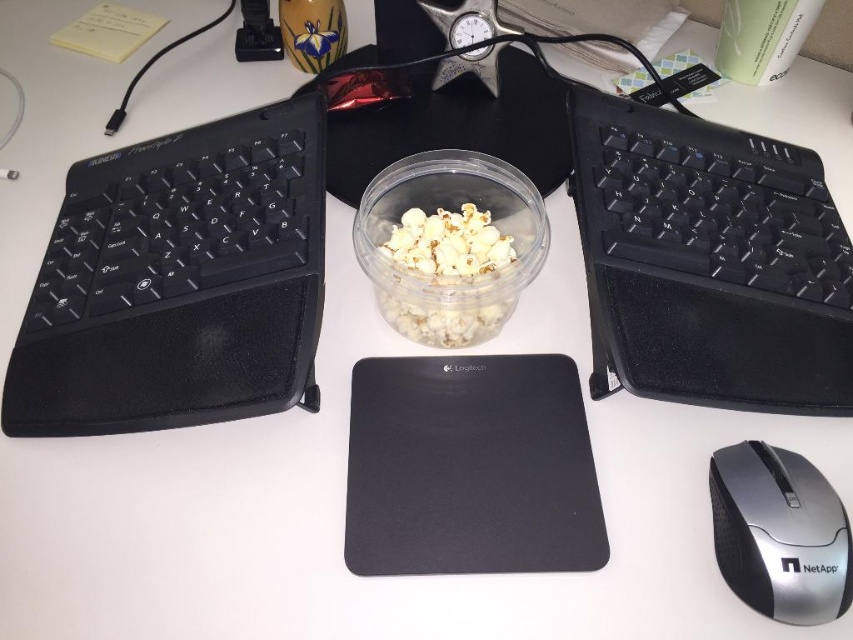
You are a graphic designer working on a project and need to place a new object at the point labeled point [709,262]. According to the scene, what object is located at that point?

The point [709,262] corresponds to the black matte keyboard at right.

You are setting up a workspace and want to place a 5 inch ruler between the black matte keyboard at right and the white matte popcorn at center. Will the ruler fit between them?

The black matte keyboard at right is 4.74 inches from the white matte popcorn at center. The ruler is 5 inches long, so it will not fit between them because the distance between the two objects is shorter than the ruler.

You are standing at a distance from the workspace setup on the white desk. A point labeled as point (276, 202) is marked on the desk. If you want to place a 12 inch ruler horizontally from this point towards the right edge of the desk, will the ruler fit entirely on the desk?

The point labeled (276, 202) is 17.53 inches away from the viewer. Since the ruler is 12 inches long, placing it horizontally from this point towards the right edge would require at least 12 inches of space. However, the distance from the point to the edge isn not specified, so we can assume the ruler might not fit entirely if the remaining space is less than 12 inches. But according to the given information, the distance between the point and the viewer is 17.53 inches. Without knowing the desk width, we